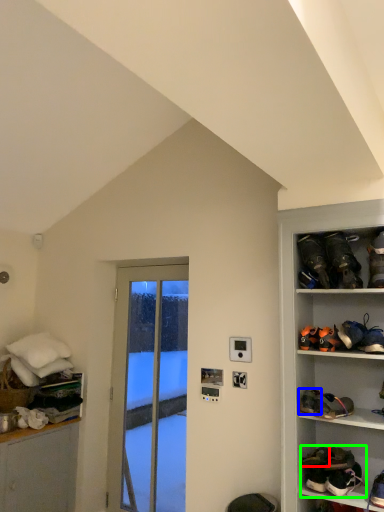
Question: Which is farther away from footwear (highlighted by a red box)? footwear (highlighted by a blue box) or footwear (highlighted by a green box)?

Choices:
 (A) footwear
 (B) footwear

Answer: (A)